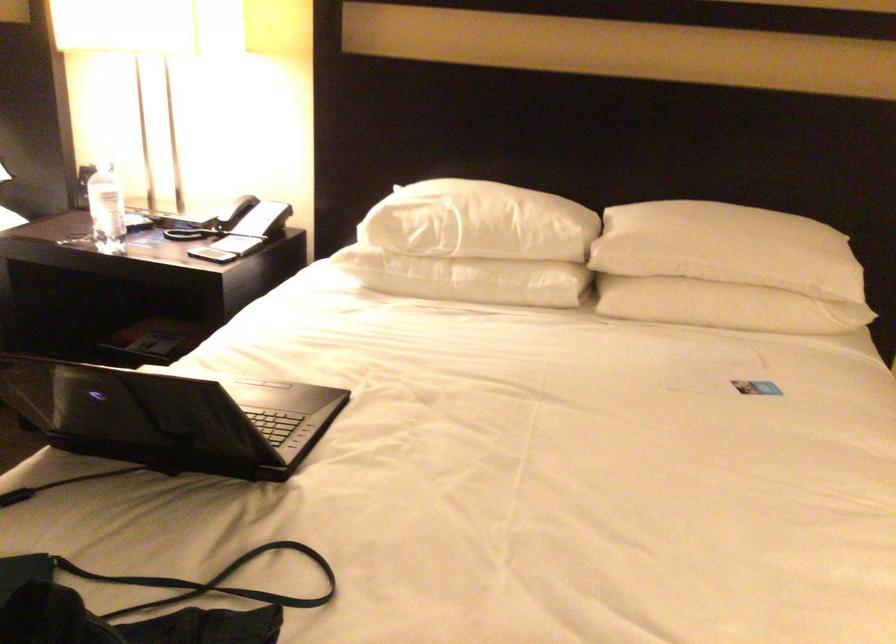
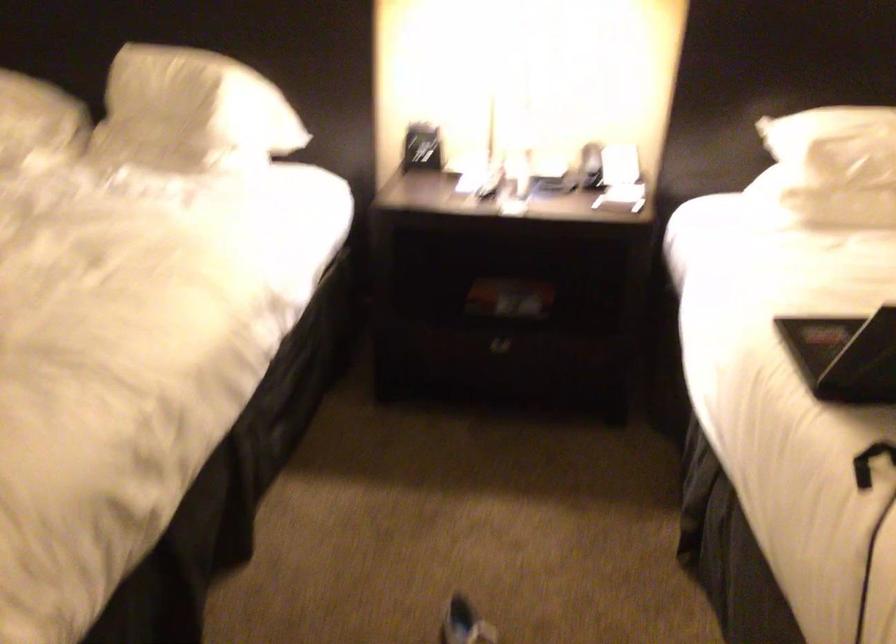
The point at (88, 409) is marked in the first image. Where is the corresponding point in the second image?

(845, 355)